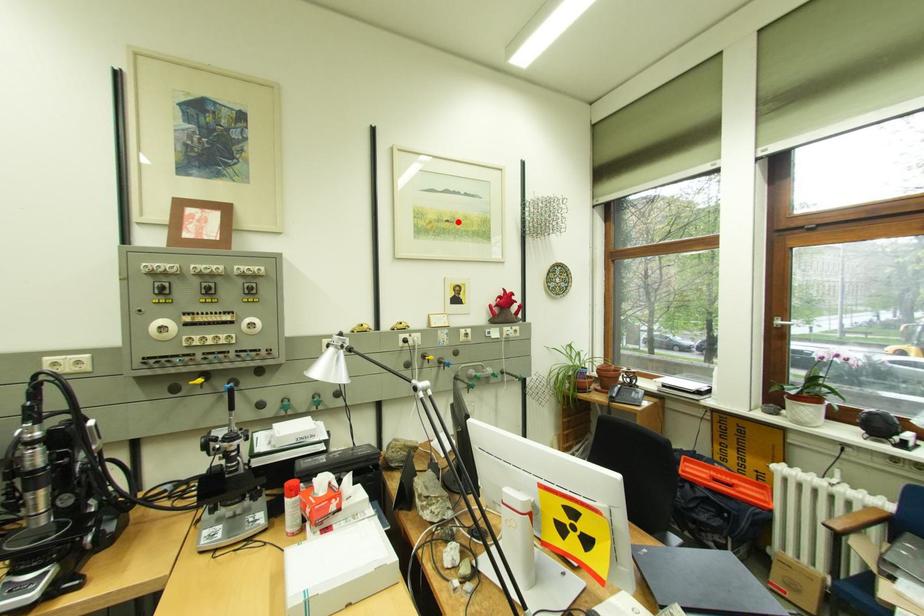
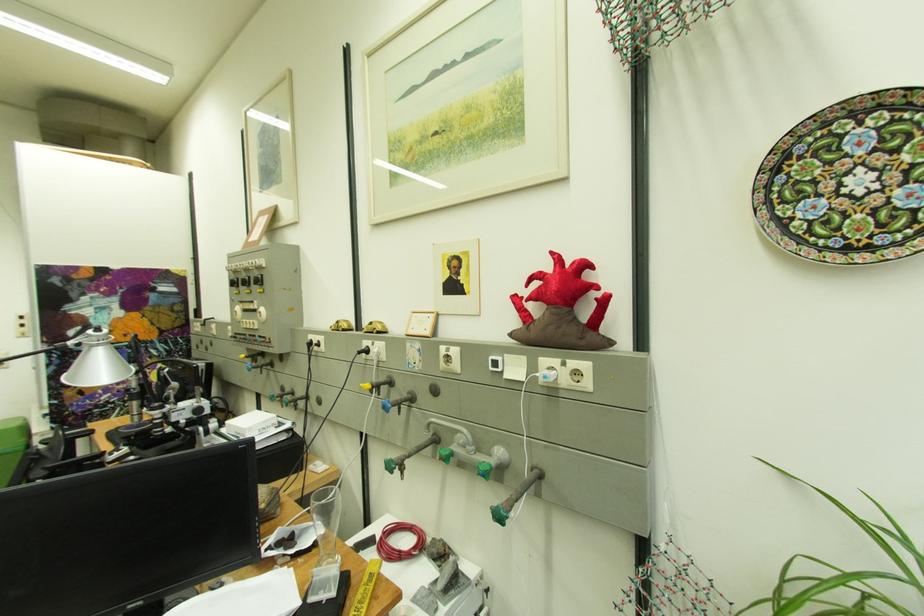
Find the pixel in the second image that matches the highlighted location in the first image.

(446, 134)